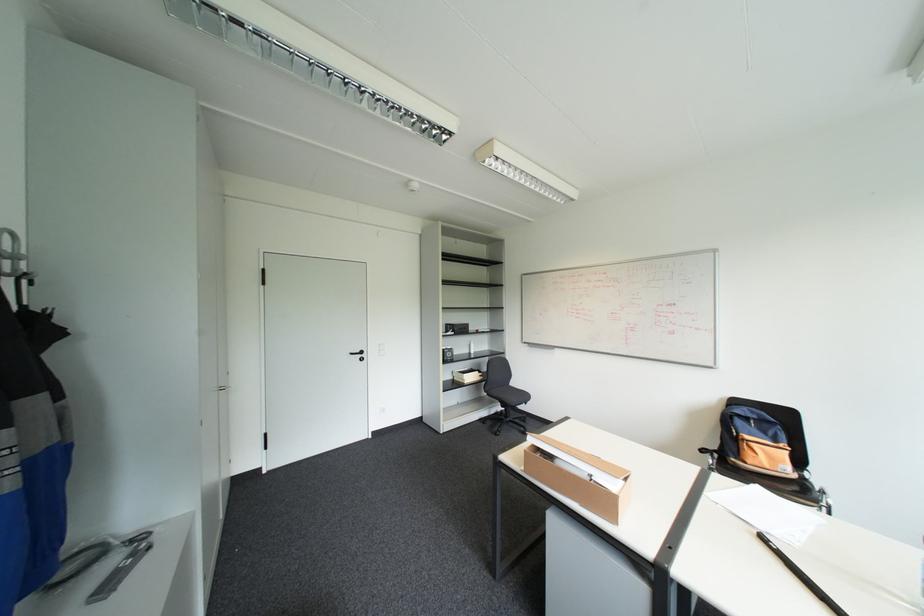
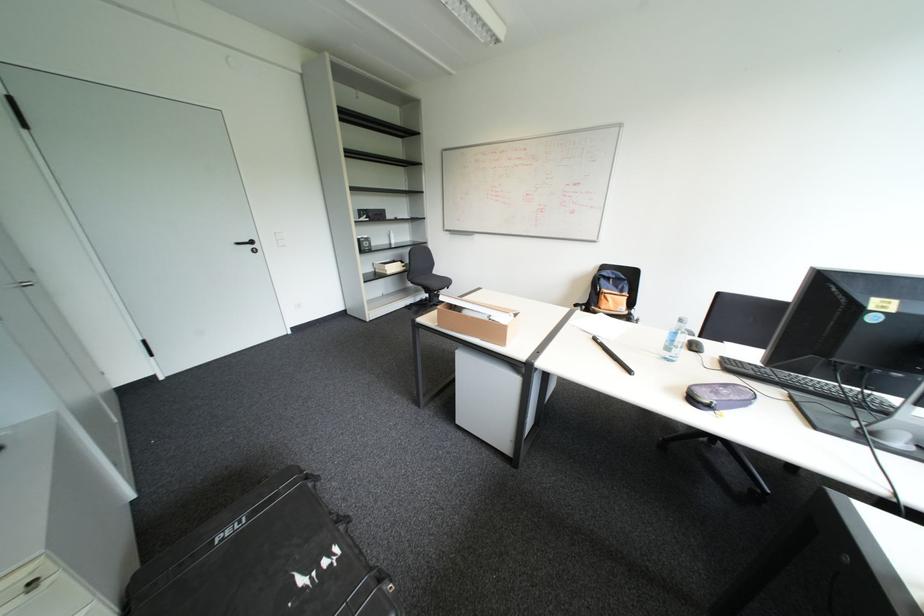
Based on the continuous images, in which direction is the camera rotating?

The camera's rotation is toward right-down.